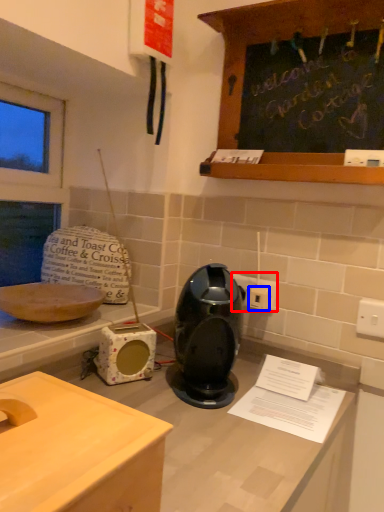
Question: Which point is closer to the camera, electric outlet (highlighted by a red box) or electric outlet (highlighted by a blue box)?

Choices:
 (A) electric outlet
 (B) electric outlet

Answer: (B)